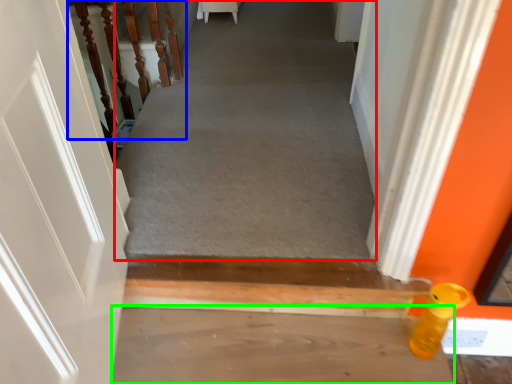
Question: Which object is the farthest from passage (highlighted by a red box)? Choose among these: stairwell (highlighted by a blue box) or concrete (highlighted by a green box).

Choices:
 (A) stairwell
 (B) concrete

Answer: (B)